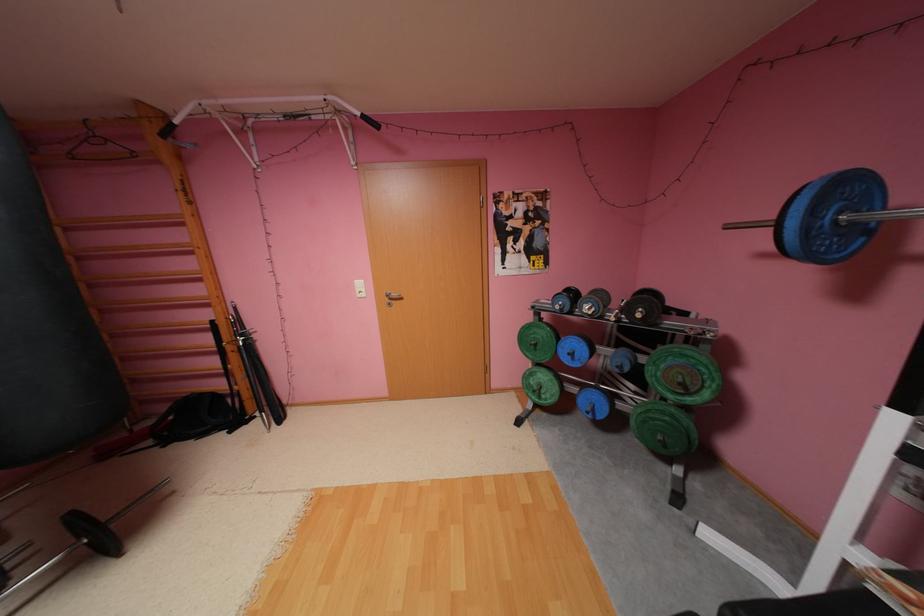
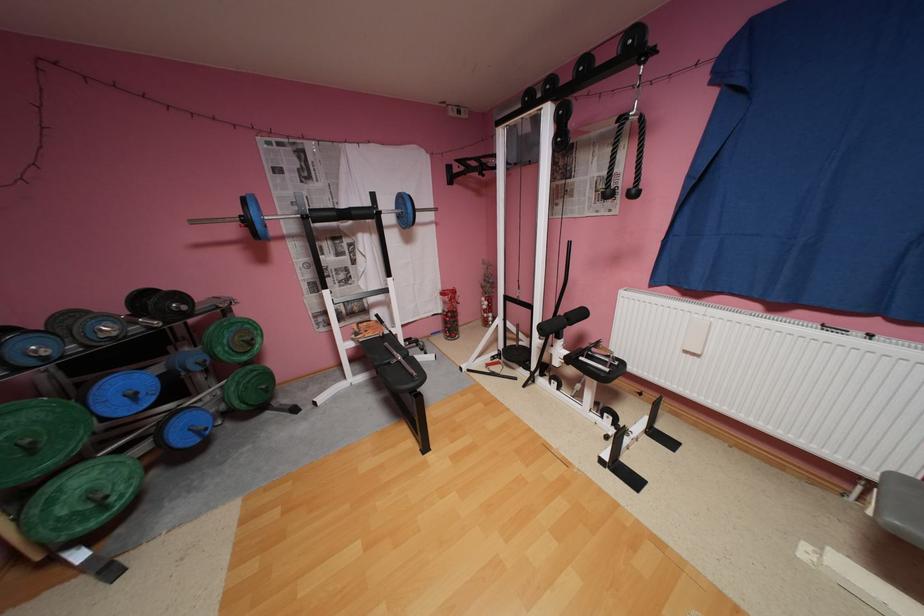
Find the pixel in the second image that matches pixel 549 398 in the first image.

(116, 508)